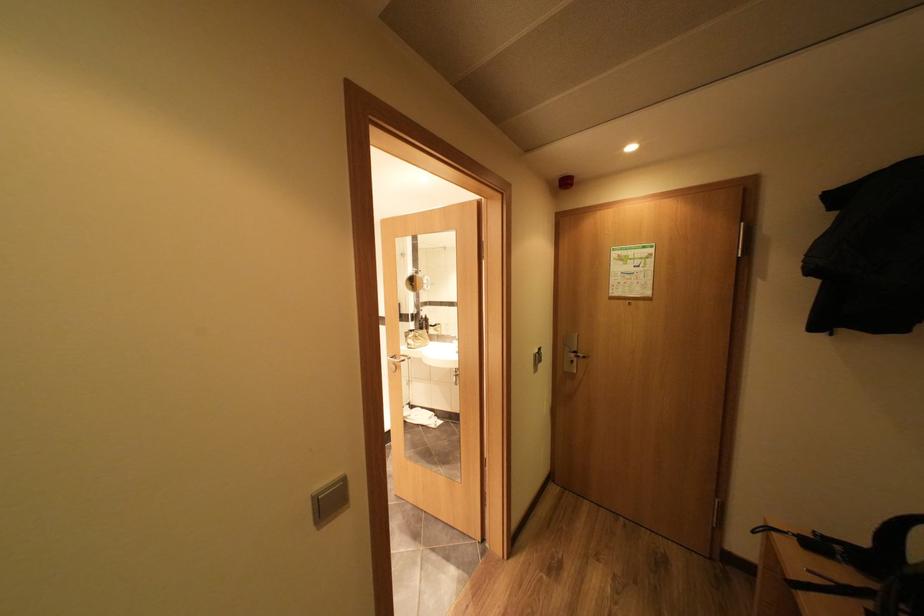
Where would you push the bottle pump top? Please return your answer as a coordinate pair (x, y).

(417, 281)